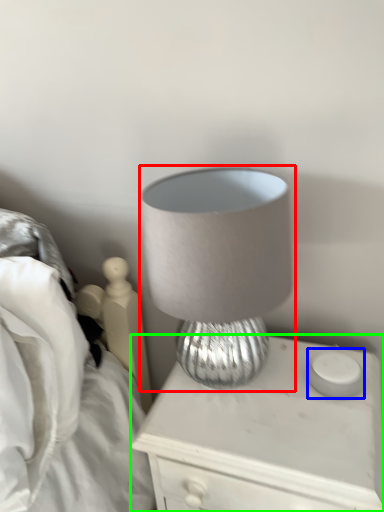
Question: Considering the real-world distances, which object is closest to lamp (highlighted by a red box)? candle holder (highlighted by a blue box) or nightstand (highlighted by a green box).

Choices:
 (A) candle holder
 (B) nightstand

Answer: (B)